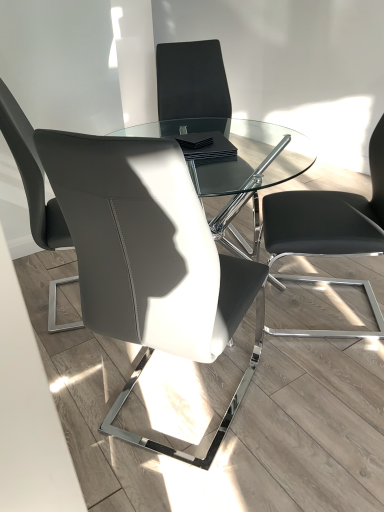
Where is `free region under black leather chair at right, the 1th chair positioned from the right (from a real-world perspective)`? free region under black leather chair at right, the 1th chair positioned from the right (from a real-world perspective) is located at coordinates click(343, 302).